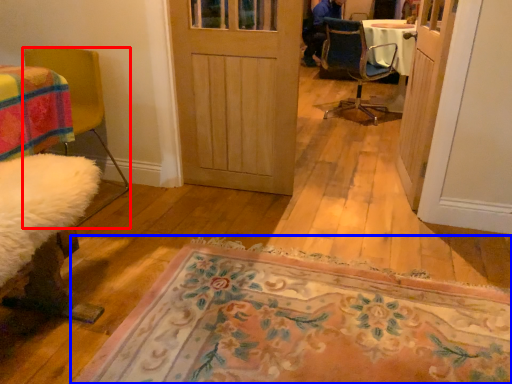
Question: Which object appears farthest to the camera in this image, chair (highlighted by a red box) or mat (highlighted by a blue box)?

Choices:
 (A) chair
 (B) mat

Answer: (A)